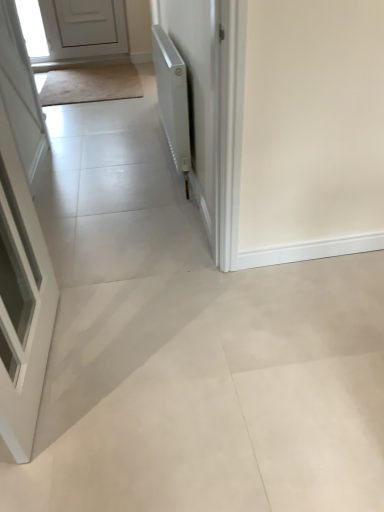
Find the location of a particular element. The width and height of the screenshot is (384, 512). free point below white glossy door at left, placed as the first door when sorted from bottom to top (from a real-world perspective) is located at coordinates (61, 356).